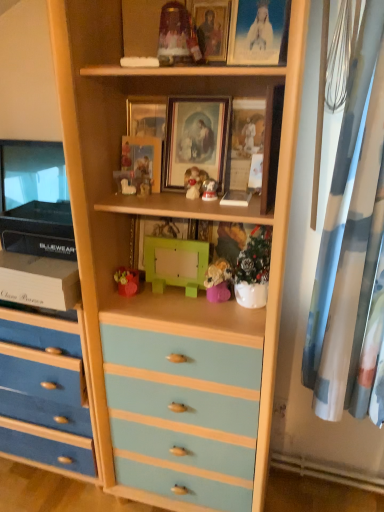
Question: Does point (205, 187) appear closer or farther from the camera than point (129, 285)?

Choices:
 (A) farther
 (B) closer

Answer: (B)

Question: From a real-world perspective, is satin gold figurine at center, which is the fourth toy in left-to-right order, above or below matte red plush toy at center, marked as the first toy in a left-to-right arrangement?

Choices:
 (A) above
 (B) below

Answer: (A)

Question: Which object is the closest to the metallic gold picture frame at upper center, acting as the 4th picture frame starting from the right?

Choices:
 (A) matte gold picture frame at upper center, the fifth picture frame positioned from the left
 (B) matte gold picture frame at center, arranged as the 5th picture frame when viewed from the right
 (C) wooden picture frame at upper center, placed as the second picture frame when sorted from right to left
 (D) satin gold figurine at center, acting as the 3th toy starting from the bottom
 (E) matte wooden picture frame at center, the 3th picture frame viewed from the right

Answer: (B)

Question: Estimate the real-world distances between objects in this image. Which object is farther from the matte glass jar at upper center, which is counted as the fourth toy, starting from the right?

Choices:
 (A) matte wooden picture frame at center, the 3th picture frame from the left
 (B) purple matte toy at center, which is the fourth toy from top to bottom
 (C) satin gold figurine at center, which is the fourth toy in left-to-right order
 (D) metallic gold picture frame at upper center, acting as the 4th picture frame starting from the right
 (E) matte gold picture frame at center, arranged as the 5th picture frame when viewed from the right

Answer: (B)